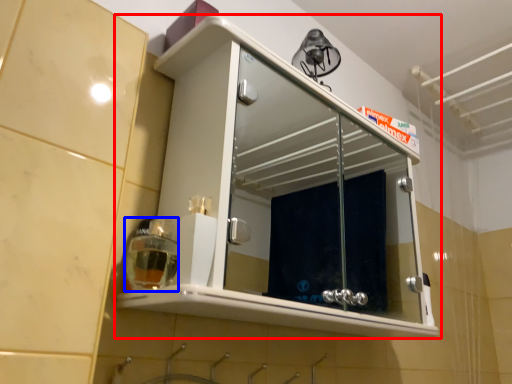
Question: Which object appears closest to the camera in this image, cabinetry (highlighted by a red box) or soap dispenser (highlighted by a blue box)?

Choices:
 (A) cabinetry
 (B) soap dispenser

Answer: (A)